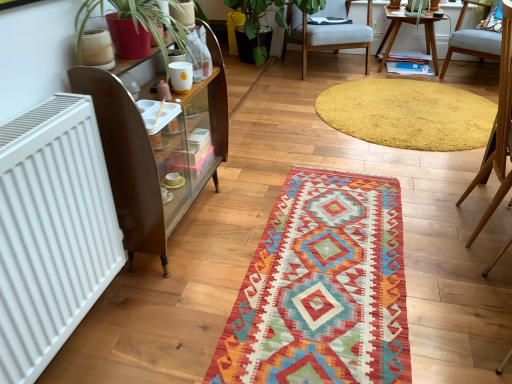
Where is `free point in front of brown wooden shelf at left`? This screenshot has height=384, width=512. free point in front of brown wooden shelf at left is located at coordinates (185, 297).